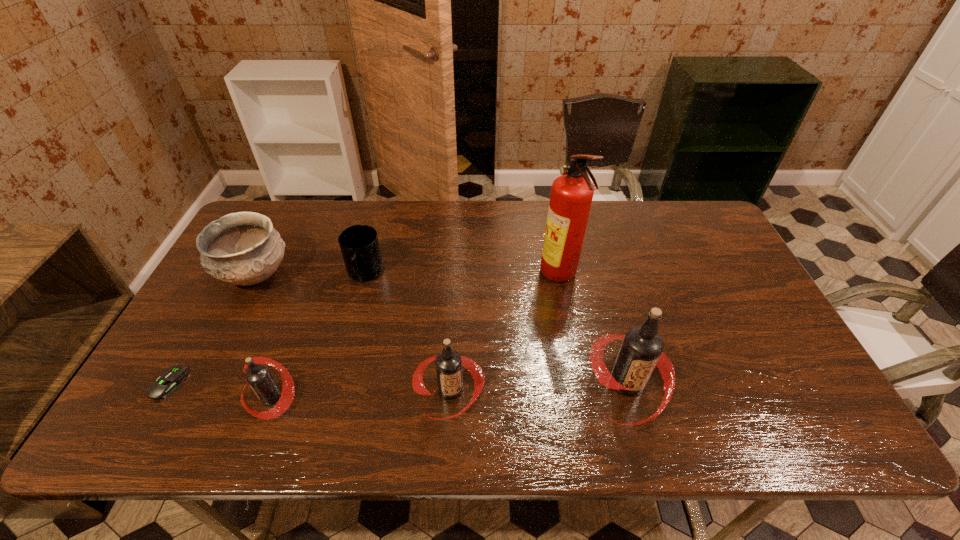
You are a GUI agent. You are given a task and a screenshot of the screen. Output one action in this format:
    pyautogui.click(x=<x>, y=<y>)
    Task: Click on the vacant region that satisfies the following two spatial constraints: 1. on the front-facing side of the tallest object; 2. on the label of the second shortest root beer
    The height and width of the screenshot is (540, 960).
    Given the screenshot: What is the action you would take?
    coord(581,390)

Locate an element on the screen. This screenshot has height=540, width=960. free space that satisfies the following two spatial constraints: 1. on the label of the second tallest object; 2. on the label of the leftmost root beer is located at coordinates (632, 396).

I want to click on free space that satisfies the following two spatial constraints: 1. on the side of the mug with the handle; 2. on the label of the shortest root beer, so click(333, 396).